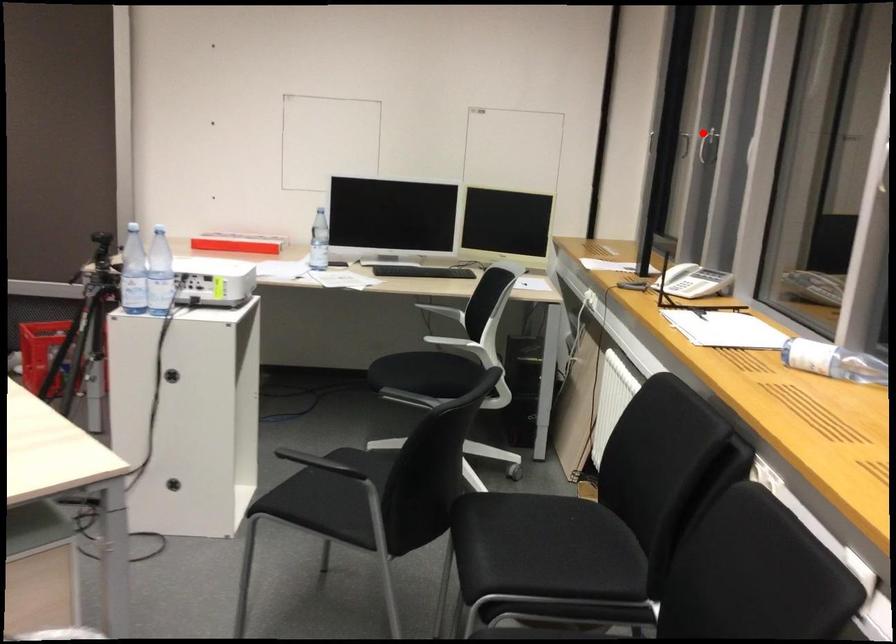
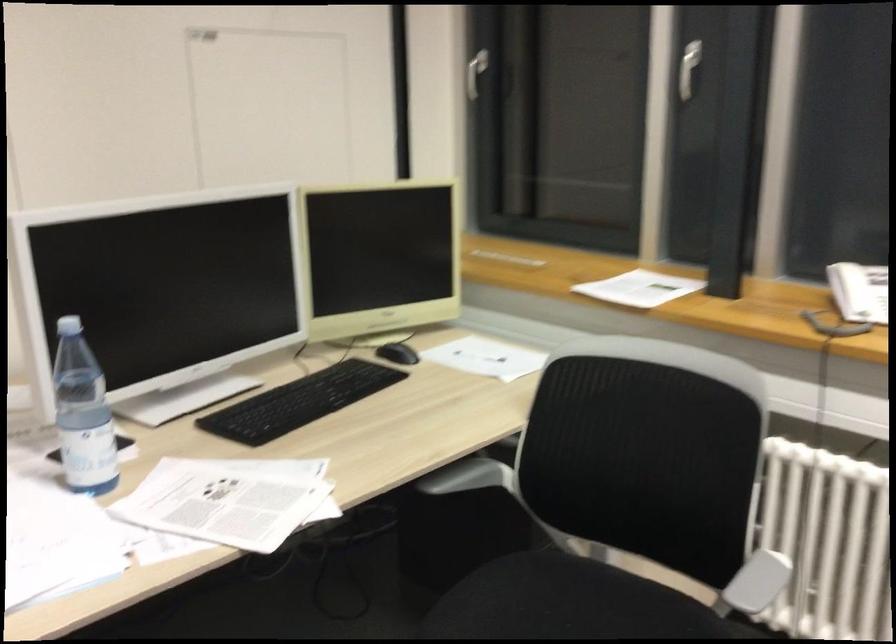
Question: I am providing you with two images of the same scene from different viewpoints. In image1, a red point is highlighted. Considering the same 3D point in image2, which of the following is correct?

Choices:
 (A) It is closer
 (B) It is farther

Answer: (A)